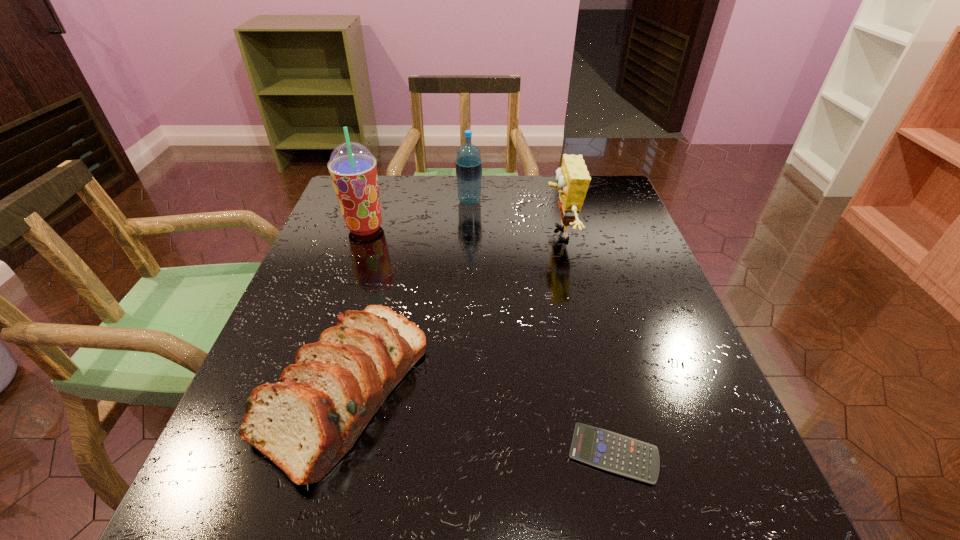
You are a GUI agent. You are given a task and a screenshot of the screen. Output one action in this format:
    pyautogui.click(x=<x>, y=<y>)
    Task: Click on the free space between the fourth tallest object and the third object from left to right
    
    Given the screenshot: What is the action you would take?
    pyautogui.click(x=407, y=295)

The width and height of the screenshot is (960, 540). What are the coordinates of `vacant area between the calculator and the smoothie` in the screenshot? It's located at (490, 341).

The image size is (960, 540). In order to click on free spot between the third object from left to right and the tallest object in this screenshot , I will do `click(418, 215)`.

You are a GUI agent. You are given a task and a screenshot of the screen. Output one action in this format:
    pyautogui.click(x=<x>, y=<y>)
    Task: Click on the unoccupied area between the shortest object and the smoothie
    This screenshot has width=960, height=540.
    Given the screenshot: What is the action you would take?
    pyautogui.click(x=490, y=341)

Find the location of a particular element. The width and height of the screenshot is (960, 540). empty space between the smoothie and the water bottle is located at coordinates (418, 215).

Locate an element on the screen. This screenshot has width=960, height=540. empty space between the tallest object and the sponge is located at coordinates (462, 231).

The height and width of the screenshot is (540, 960). What are the coordinates of `vacant area that lies between the second shortest object and the sponge` in the screenshot? It's located at (452, 312).

This screenshot has width=960, height=540. I want to click on free space between the shortest object and the third object from left to right, so click(541, 327).

Locate an element on the screen. The height and width of the screenshot is (540, 960). free space between the second shortest object and the smoothie is located at coordinates (355, 308).

Find the location of a particular element. vacant area that lies between the calculator and the smoothie is located at coordinates (490, 341).